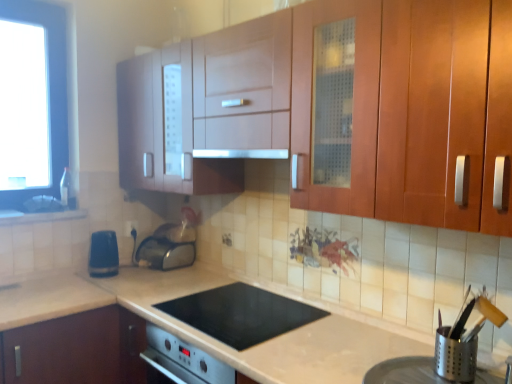
Where is `free spot behind silver metallic utensil holder at lower right, the 2th appliance from the front`? Image resolution: width=512 pixels, height=384 pixels. free spot behind silver metallic utensil holder at lower right, the 2th appliance from the front is located at coordinates (422, 355).